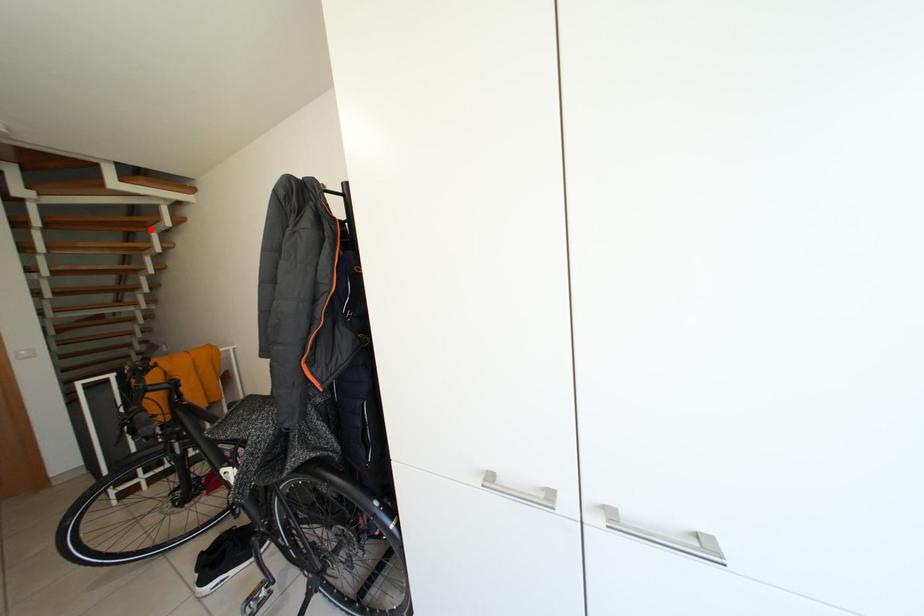
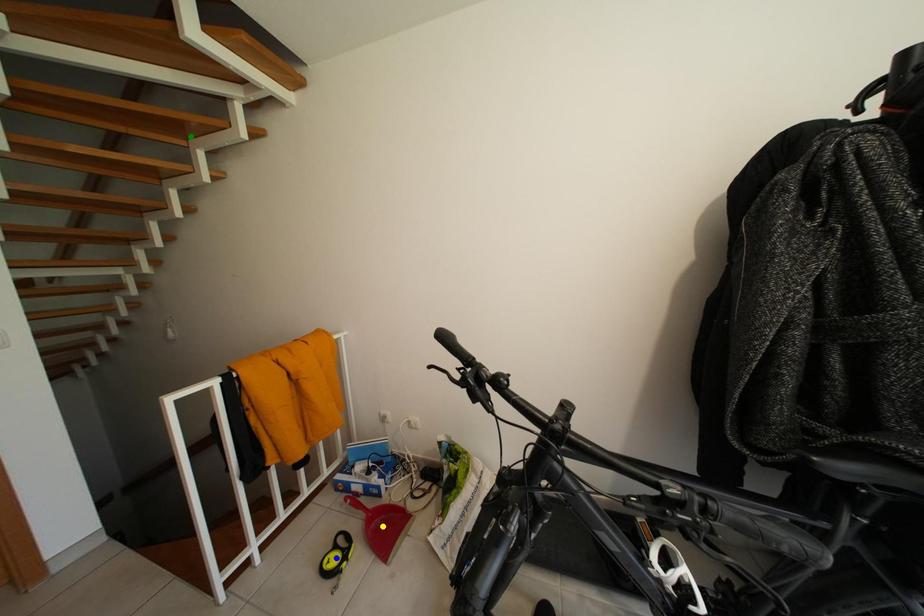
Question: I am providing you with two images of the same scene from different viewpoints. A red point is marked on the first image. You are given multiple points on the second image. Which point in image 2 represents the same 3d spot as the red point in image 1?

Choices:
 (A) blue point
 (B) yellow point
 (C) green point

Answer: (C)